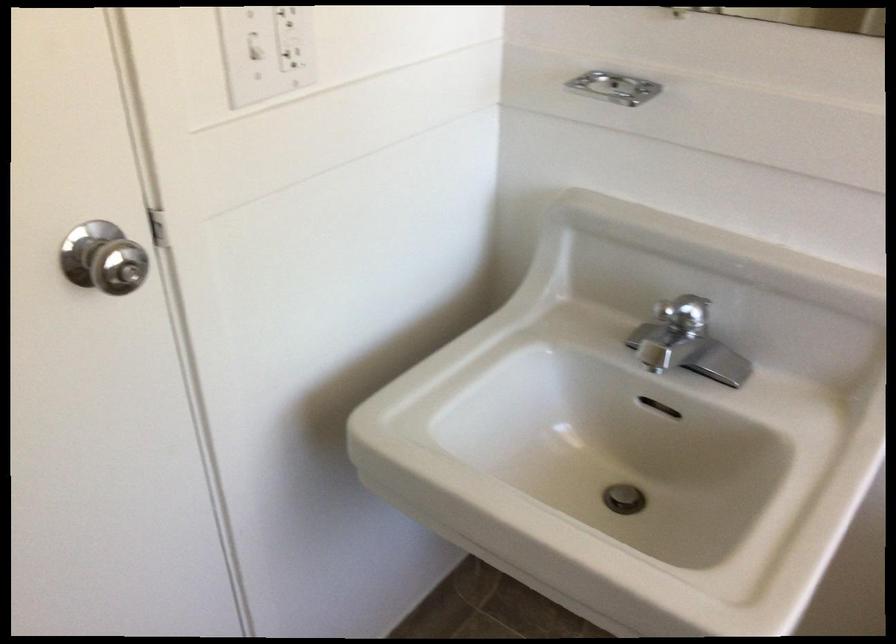
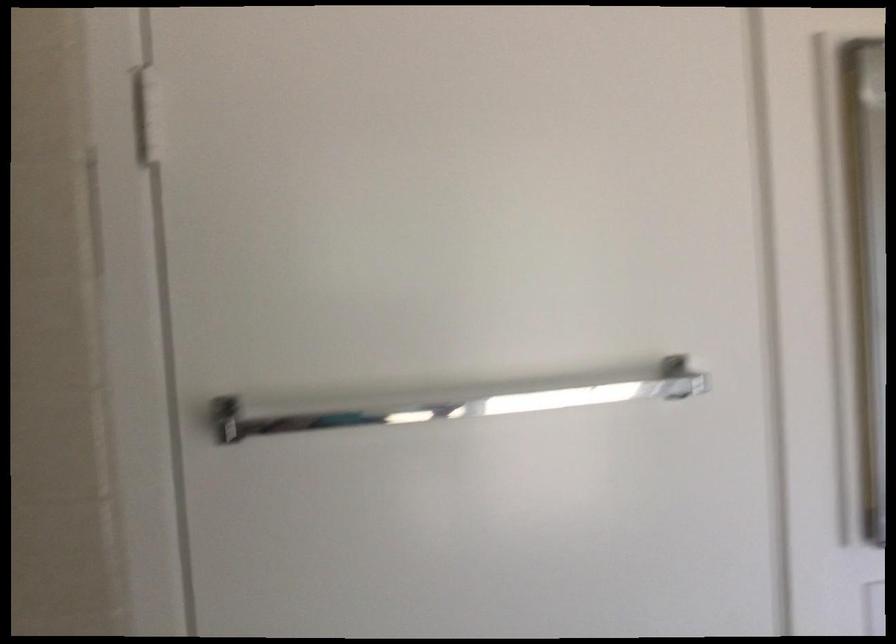
The images are taken continuously from a first-person perspective. In which direction is your viewpoint rotating?

The camera's rotation is toward left-up.